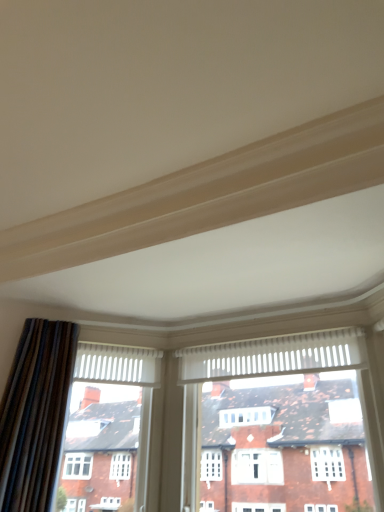
This screenshot has height=512, width=384. Describe the element at coordinates (36, 415) in the screenshot. I see `velvet-like brown curtain at left` at that location.

This screenshot has height=512, width=384. In order to click on velvet-like brown curtain at left in this screenshot , I will do `click(36, 415)`.

What do you see at coordinates (291, 423) in the screenshot? The width and height of the screenshot is (384, 512). I see `white textured window at center` at bounding box center [291, 423].

Find the location of `white textured window at center`. white textured window at center is located at coordinates (291, 423).

In order to face white textured window at center, should I rotate leftwards or rightwards?

It's best to rotate right around 10.335 degrees.

At what (x,y) coordinates should I click in order to perform the action: click on velvet-like brown curtain at left. Please return your answer as a coordinate pair (x, y). The image size is (384, 512). Looking at the image, I should click on (36, 415).

Considering the positions of objects velvet-like brown curtain at left and white textured window at center in the image provided, who is more to the right, velvet-like brown curtain at left or white textured window at center?

From the viewer's perspective, white textured window at center appears more on the right side.

Which object is more forward, velvet-like brown curtain at left or white textured window at center?

velvet-like brown curtain at left.

Considering the points (65, 332) and (293, 449), which point is in front, point (65, 332) or point (293, 449)?

The point (293, 449) is closer to the camera.

From the image's perspective, which is above, velvet-like brown curtain at left or white textured window at center?

velvet-like brown curtain at left.

From a real-world perspective, which is physically above, velvet-like brown curtain at left or white textured window at center?

velvet-like brown curtain at left, from a real-world perspective.

Looking at their sizes, would you say velvet-like brown curtain at left is wider or thinner than white textured window at center?

velvet-like brown curtain at left is wider than white textured window at center.

Which of these two, velvet-like brown curtain at left or white textured window at center, stands taller?

velvet-like brown curtain at left.

Considering the relative sizes of velvet-like brown curtain at left and white textured window at center in the image provided, is velvet-like brown curtain at left smaller than white textured window at center?

Indeed, velvet-like brown curtain at left has a smaller size compared to white textured window at center.

Which is correct: velvet-like brown curtain at left is inside white textured window at center, or outside of it?

velvet-like brown curtain at left is spatially situated outside white textured window at center.

Looking at this image, are velvet-like brown curtain at left and white textured window at center making contact?

No, velvet-like brown curtain at left is not next to white textured window at center.

Could you tell me if velvet-like brown curtain at left is turned towards white textured window at center?

No, velvet-like brown curtain at left is not turned towards white textured window at center.

What's the angular difference between velvet-like brown curtain at left and white textured window at center's facing directions?

43.7 degrees.

Measure the distance from velvet-like brown curtain at left to white textured window at center.

velvet-like brown curtain at left and white textured window at center are 3.61 feet apart from each other.

Image resolution: width=384 pixels, height=512 pixels. I want to click on window that is below the velvet-like brown curtain at left (from the image's perspective), so point(291,423).

Is white textured window at center to the left of velvet-like brown curtain at left from the viewer's perspective?

No.

Is white textured window at center further to the viewer compared to velvet-like brown curtain at left?

Yes, white textured window at center is further from the camera.

Is point (342, 477) more distant than point (8, 475)?

Yes, it is behind point (8, 475).

Looking at this image, from the image's perspective, is white textured window at center located beneath velvet-like brown curtain at left?

Yes, from the image's perspective, white textured window at center is beneath velvet-like brown curtain at left.

From a real-world perspective, who is located higher, white textured window at center or velvet-like brown curtain at left?

velvet-like brown curtain at left.

Does white textured window at center have a lesser width compared to velvet-like brown curtain at left?

Indeed, white textured window at center has a lesser width compared to velvet-like brown curtain at left.

Can you confirm if white textured window at center is shorter than velvet-like brown curtain at left?

Indeed, white textured window at center has a lesser height compared to velvet-like brown curtain at left.

Considering the relative sizes of white textured window at center and velvet-like brown curtain at left in the image provided, is white textured window at center smaller than velvet-like brown curtain at left?

Incorrect, white textured window at center is not smaller in size than velvet-like brown curtain at left.

Would you say white textured window at center contains velvet-like brown curtain at left?

Definitely not — velvet-like brown curtain at left is not inside white textured window at center.

Is the surface of white textured window at center in direct contact with velvet-like brown curtain at left?

white textured window at center and velvet-like brown curtain at left are not in contact.

Is white textured window at center oriented away from velvet-like brown curtain at left?

No.

Measure the distance between white textured window at center and velvet-like brown curtain at left.

3.61 feet.

I want to click on window below the velvet-like brown curtain at left (from the image's perspective), so click(x=291, y=423).

This screenshot has width=384, height=512. In order to click on window behind the velvet-like brown curtain at left in this screenshot , I will do `click(291, 423)`.

Locate an element on the screen. curtain located on the left of white textured window at center is located at coordinates (36, 415).